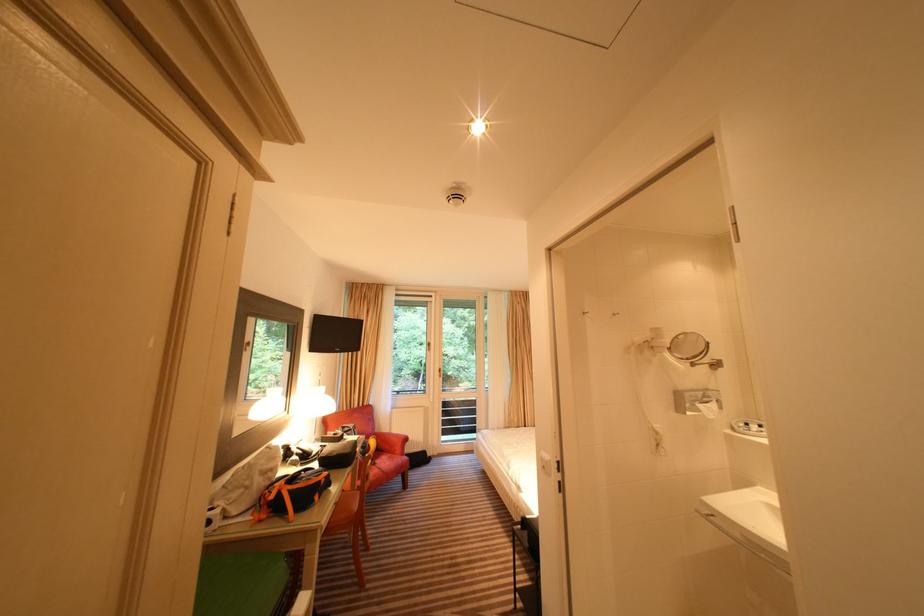
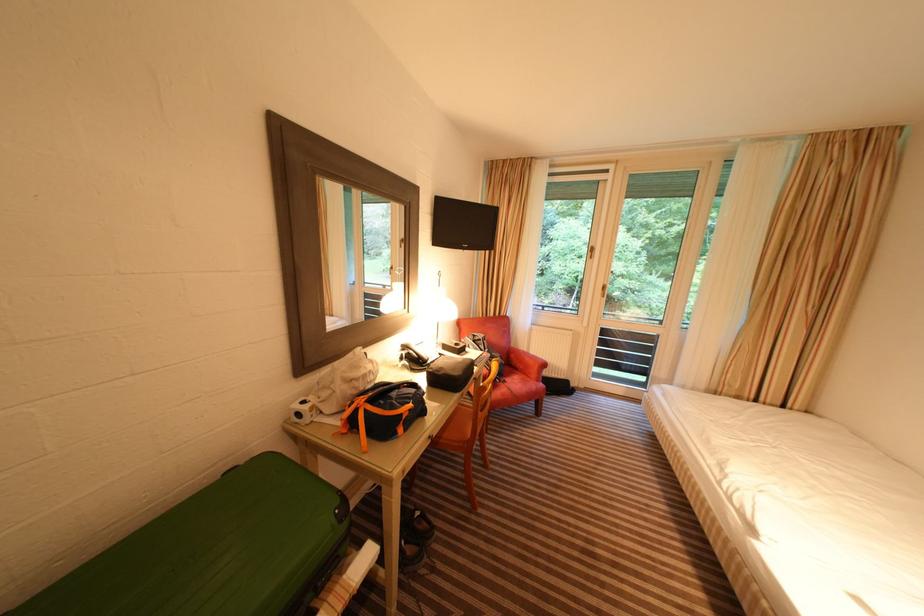
The point at (431,347) is marked in the first image. Where is the corresponding point in the second image?

(590, 254)